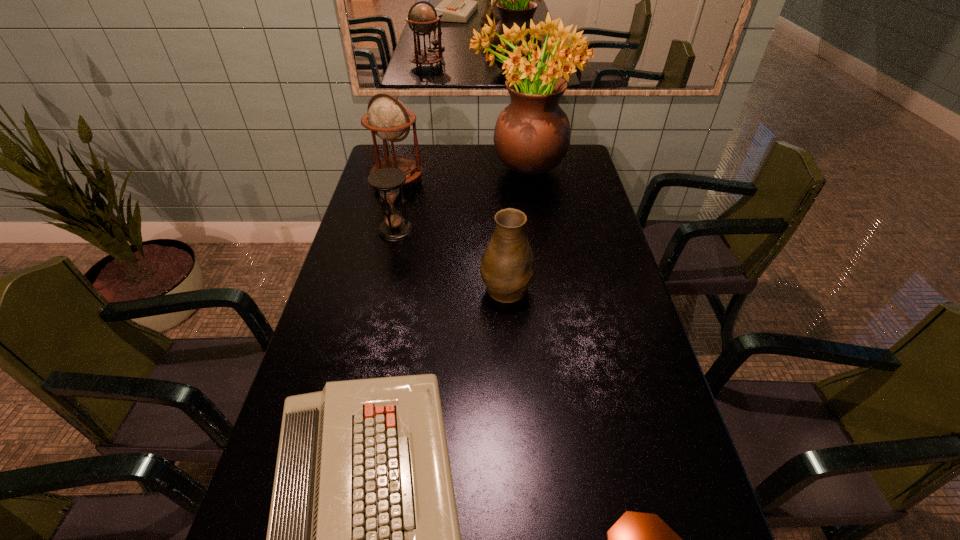
In the image, there is a desktop. Where is `free space at the left edge`? free space at the left edge is located at coordinates (377, 211).

In the image, there is a desktop. Identify the location of vacant space at the right edge. This screenshot has width=960, height=540. (577, 296).

Where is `vacant space at the far left corner of the desktop`? Image resolution: width=960 pixels, height=540 pixels. vacant space at the far left corner of the desktop is located at coordinates (414, 146).

In the image, there is a desktop. Where is `vacant space at the far right corner`? The width and height of the screenshot is (960, 540). vacant space at the far right corner is located at coordinates point(576,144).

Locate an element on the screen. The height and width of the screenshot is (540, 960). unoccupied area between the globe and the tallest object is located at coordinates (460, 173).

Identify the location of empty location between the fourth shortest object and the left hourglass. The image size is (960, 540). (451, 258).

Select which object appears as the third closest to the nearer hourglass. Please provide its 2D coordinates. Your answer should be formatted as a tuple, i.e. [(x, y)], where the tuple contains the x and y coordinates of a point satisfying the conditions above.

[(387, 180)]

Locate an element on the screen. object that is the closest to the shortest object is located at coordinates (637, 539).

Where is `vacant space that satisfies the following two spatial constraints: 1. on the surface of the left hourglass; 2. on the left side of the globe`? vacant space that satisfies the following two spatial constraints: 1. on the surface of the left hourglass; 2. on the left side of the globe is located at coordinates (385, 230).